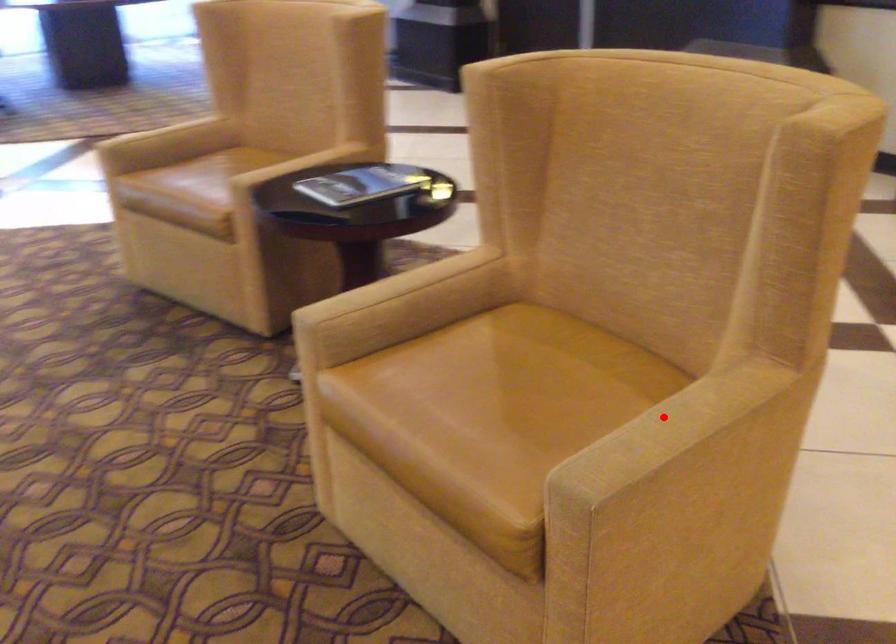
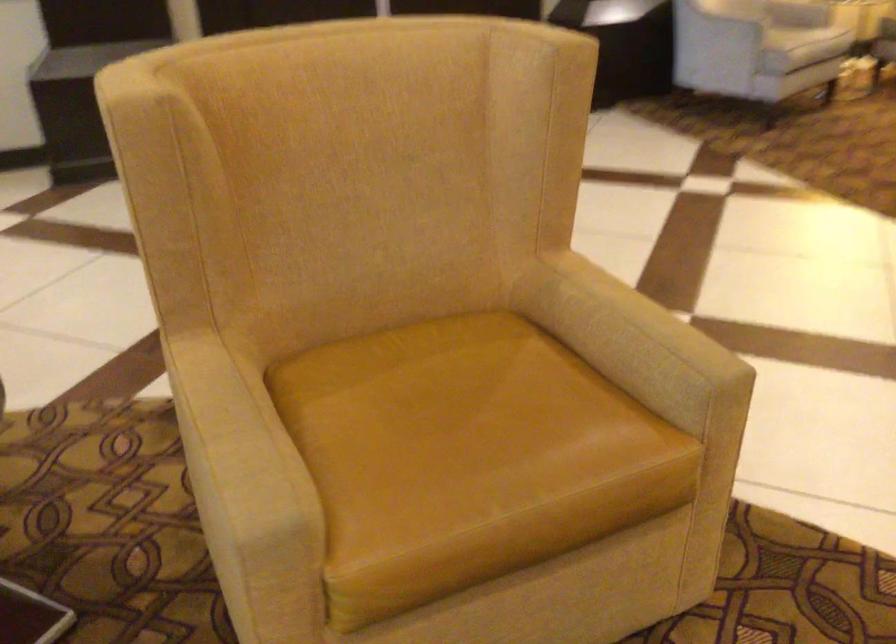
Locate, in the second image, the point that corresponds to the highlighted location in the first image.

(624, 322)